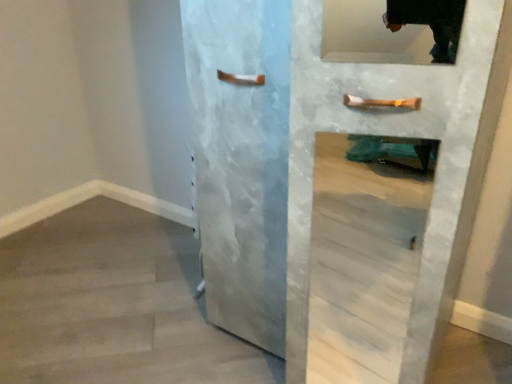
Where is `free space to the left of matte white cabinet at center`? free space to the left of matte white cabinet at center is located at coordinates (139, 315).